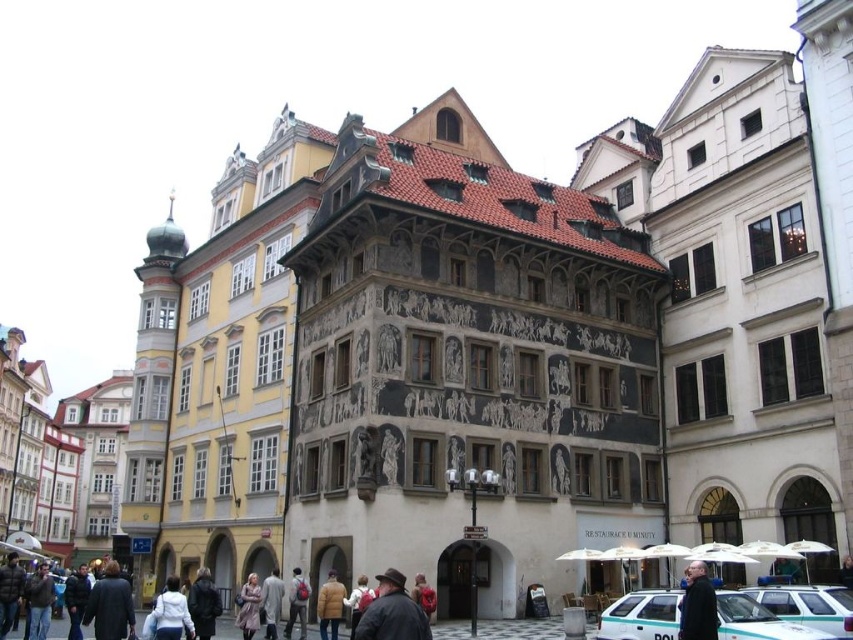
Between point (693, 563) and point (325, 586), which one is positioned in front?

Point (325, 586)

Who is more distant from viewer, (692, 637) or (321, 637)?

Point (321, 637)

Identify the location of dark gray coat at center. (698, 605).

Is teal glossy police car at lower right to the right of dark gray coat at center from the viewer's perspective?

Correct, you'll find teal glossy police car at lower right to the right of dark gray coat at center.

Can you confirm if teal glossy police car at lower right is thinner than dark gray coat at center?

No, teal glossy police car at lower right is not thinner than dark gray coat at center.

The width and height of the screenshot is (853, 640). I want to click on teal glossy police car at lower right, so click(642, 616).

Is point (650, 618) behind point (248, 596)?

No, it is not.

Who is positioned more to the left, teal glossy police car at lower right or light brown wool coat at lower center?

Positioned to the left is light brown wool coat at lower center.

Is point (784, 632) positioned before point (256, 625)?

Yes, point (784, 632) is in front of point (256, 625).

Locate an element on the screen. teal glossy police car at lower right is located at coordinates (642, 616).